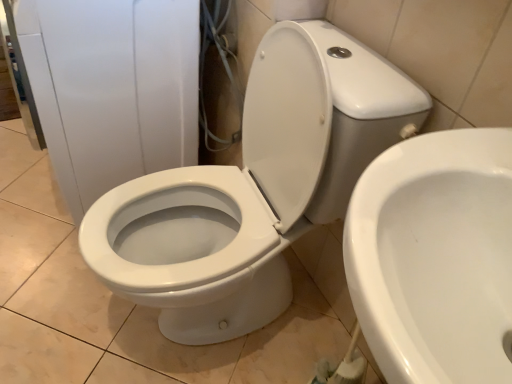
Question: Is white glossy toilet at center, arranged as the first toilet when viewed from the left, bigger or smaller than white glossy toilet at center, the first toilet viewed from the right?

Choices:
 (A) small
 (B) big

Answer: (B)

Question: Is white glossy toilet at center, arranged as the first toilet when viewed from the left, inside the boundaries of white glossy toilet at center, the first toilet viewed from the right, or outside?

Choices:
 (A) outside
 (B) inside

Answer: (A)

Question: Estimate the real-world distances between objects in this image. Which object is farther from the white glossy toilet at center, the first toilet viewed from the right?

Choices:
 (A) white glossy toilet at center
 (B) white glossy toilet at center, which is the 2th toilet from right to left

Answer: (A)

Question: Which of these objects is positioned farthest from the white glossy toilet at center?

Choices:
 (A) white glossy toilet at center, which is the 2th toilet from right to left
 (B) white glossy toilet at center, the first toilet viewed from the right

Answer: (B)